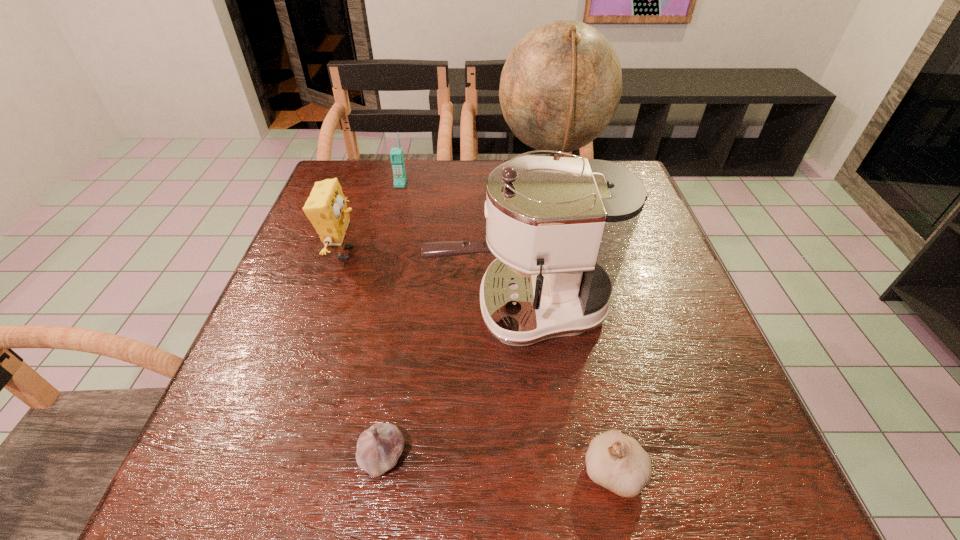
Locate which object is the fourth closest to the leftmost object. Please provide its 2D coordinates. Your answer should be formatted as a tuple, i.e. [(x, y)], where the tuple contains the x and y coordinates of a point satisfying the conditions above.

[(378, 448)]

Choose which object is the third nearest neighbor to the leftmost object. Please provide its 2D coordinates. Your answer should be formatted as a tuple, i.e. [(x, y)], where the tuple contains the x and y coordinates of a point satisfying the conditions above.

[(560, 87)]

The image size is (960, 540). What are the coordinates of `vacant region that satisfies the following two spatial constraints: 1. on the front-facing side of the tallest object; 2. on the left side of the right garlic` in the screenshot? It's located at (605, 470).

I want to click on vacant region that satisfies the following two spatial constraints: 1. on the keypad of the second object from left to right; 2. on the left side of the left garlic, so click(336, 456).

Find the location of a particular element. free space that satisfies the following two spatial constraints: 1. on the back side of the right garlic; 2. on the face of the leftmost object is located at coordinates (566, 253).

I want to click on vacant space that satisfies the following two spatial constraints: 1. on the front-facing side of the fifth shortest object; 2. on the back side of the right garlic, so click(533, 470).

What are the coordinates of `blank area in the image that satisfies the following two spatial constraints: 1. on the back side of the right garlic; 2. on the front-facing side of the globe` in the screenshot? It's located at [x=553, y=189].

Image resolution: width=960 pixels, height=540 pixels. Identify the location of vacant region that satisfies the following two spatial constraints: 1. on the front-facing side of the tallest object; 2. on the right side of the right garlic. (605, 470).

Find the location of a particular element. vacant region that satisfies the following two spatial constraints: 1. on the front-facing side of the right garlic; 2. on the right side of the fifth shortest object is located at coordinates (533, 470).

The height and width of the screenshot is (540, 960). What are the coordinates of `free space that satisfies the following two spatial constraints: 1. on the face of the leftmost object; 2. on the right side of the fourth object from right to left` in the screenshot? It's located at (276, 456).